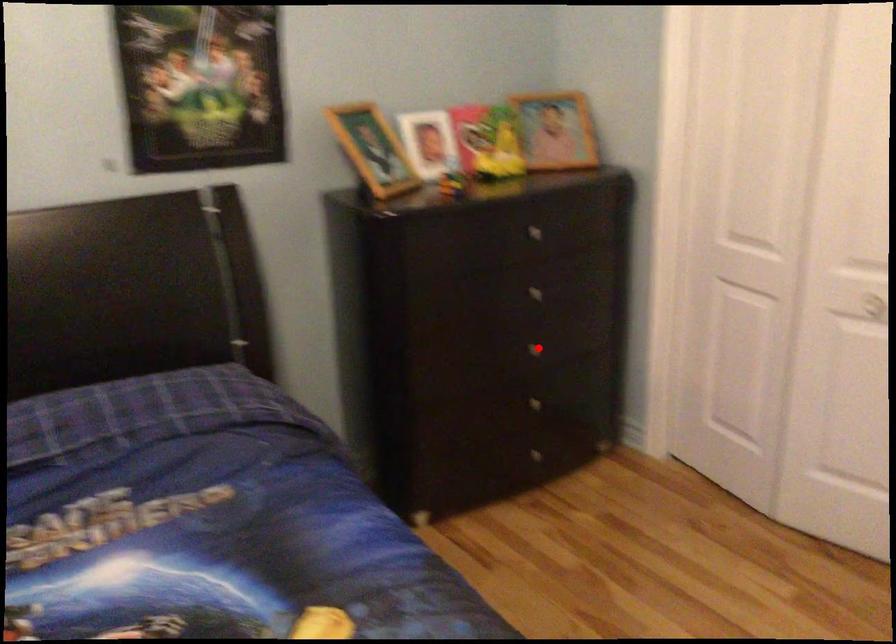
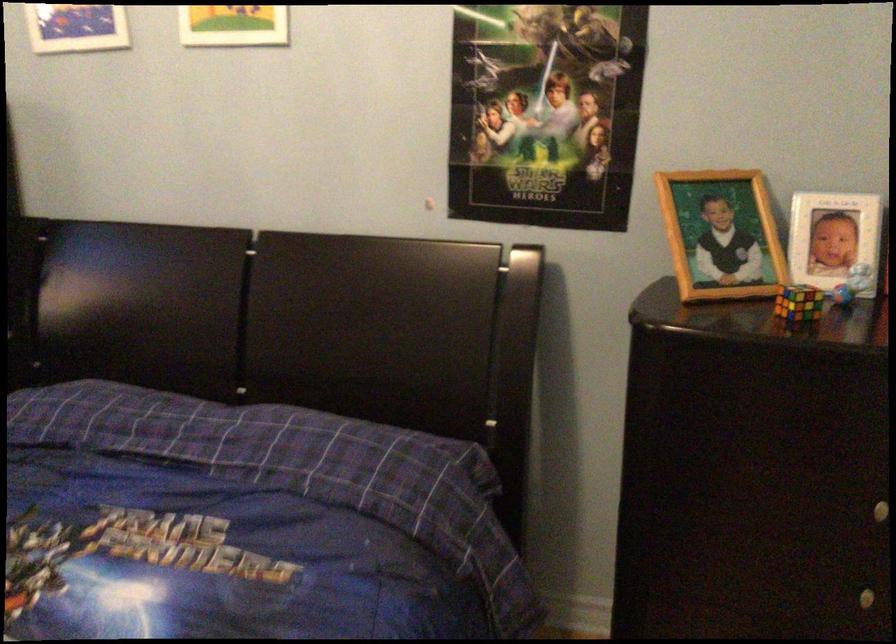
Question: I am providing you with two images of the same scene from different viewpoints. Given a red point in image1, look at the same physical point in image2. Is it:

Choices:
 (A) Closer to the viewpoint
 (B) Farther from the viewpoint

Answer: (A)